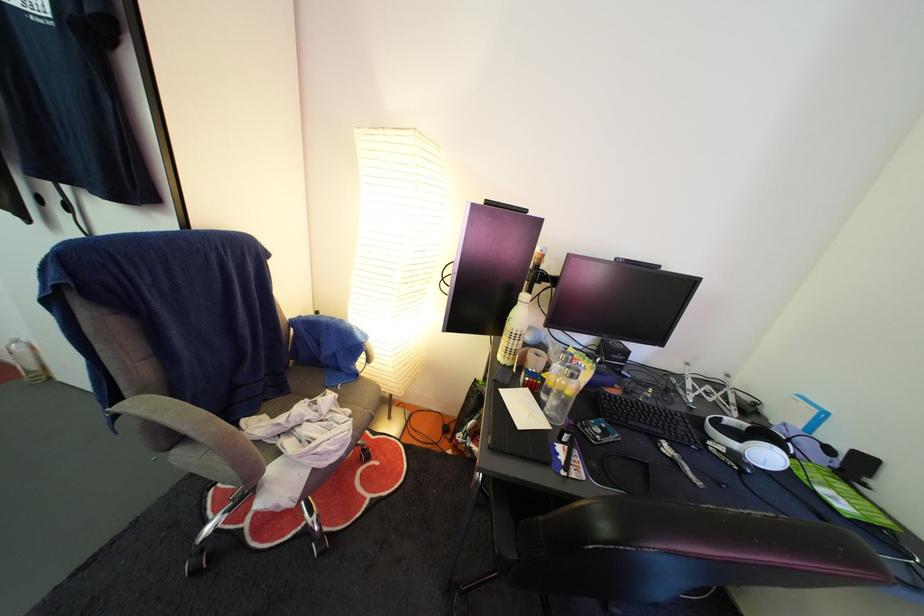
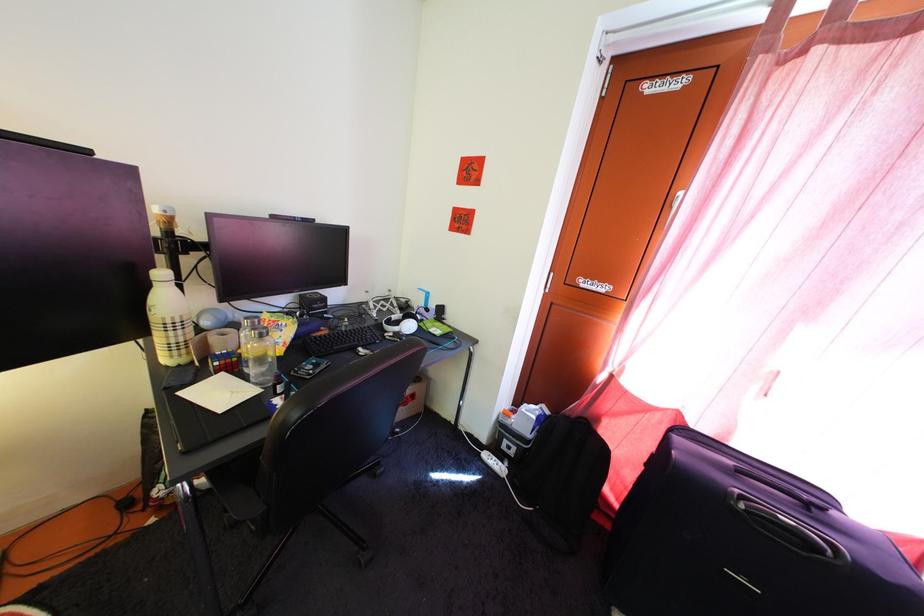
Find the pixel in the second image that matches point (709, 405) in the first image.

(388, 318)